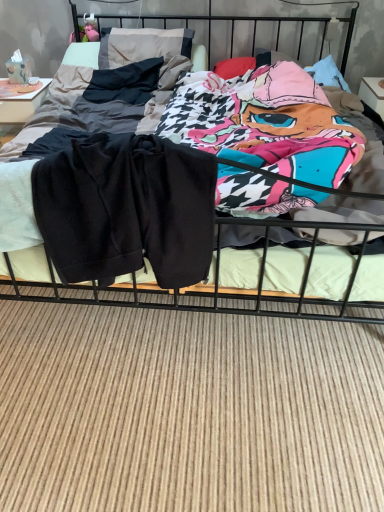
Question: From a real-world perspective, is dark gray fabric pillow at upper left positioned above or below black cotton shorts at center?

Choices:
 (A) above
 (B) below

Answer: (A)

Question: Which is correct: dark gray fabric pillow at upper left is inside black cotton shorts at center, or outside of it?

Choices:
 (A) inside
 (B) outside

Answer: (A)

Question: Considering the real-world distances, which object is farthest from the black fleece shorts at center?

Choices:
 (A) black cotton shorts at center
 (B) dark gray fabric pillow at upper left

Answer: (A)

Question: Which object is positioned farthest from the black fleece shorts at center?

Choices:
 (A) black cotton shorts at center
 (B) dark gray fabric pillow at upper left

Answer: (A)